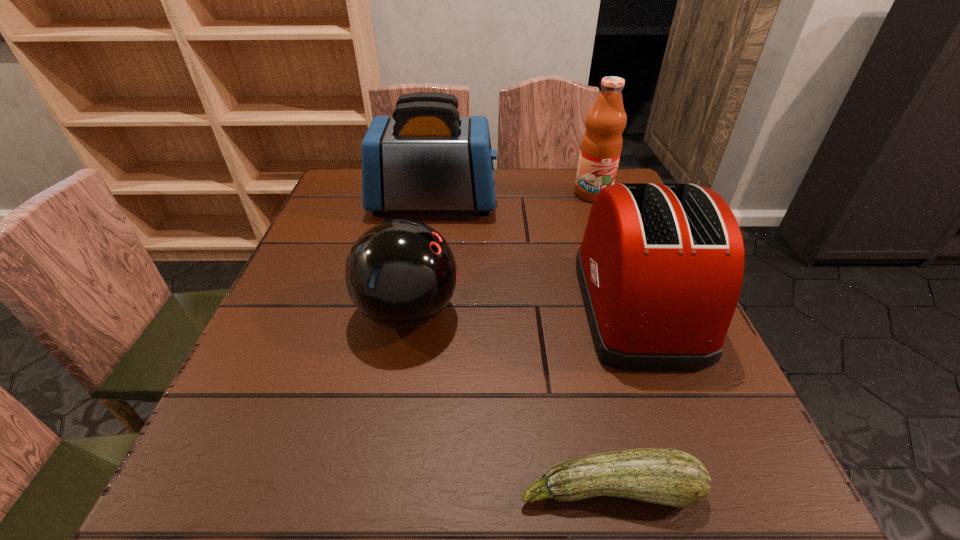
Identify the location of vacant point that satisfies the following two spatial constraints: 1. on the front label of the fruit juice; 2. on the front-facing side of the farther toaster. (595, 202).

At what (x,y) coordinates should I click in order to perform the action: click on free spot that satisfies the following two spatial constraints: 1. on the front label of the fruit juice; 2. on the left side of the nearer toaster. Please return your answer as a coordinate pair (x, y). Looking at the image, I should click on (634, 304).

You are a GUI agent. You are given a task and a screenshot of the screen. Output one action in this format:
    pyautogui.click(x=<x>, y=<y>)
    Task: Click on the vacant area that satisfies the following two spatial constraints: 1. on the front label of the nearer toaster; 2. on the left side of the fruit juice
    Image resolution: width=960 pixels, height=540 pixels.
    Given the screenshot: What is the action you would take?
    pyautogui.click(x=634, y=304)

The height and width of the screenshot is (540, 960). I want to click on free point that satisfies the following two spatial constraints: 1. on the front label of the fruit juice; 2. on the front-facing side of the left toaster, so click(595, 202).

Locate an element on the screen. This screenshot has width=960, height=540. vacant space that satisfies the following two spatial constraints: 1. on the front label of the fruit juice; 2. on the front-facing side of the left toaster is located at coordinates (595, 202).